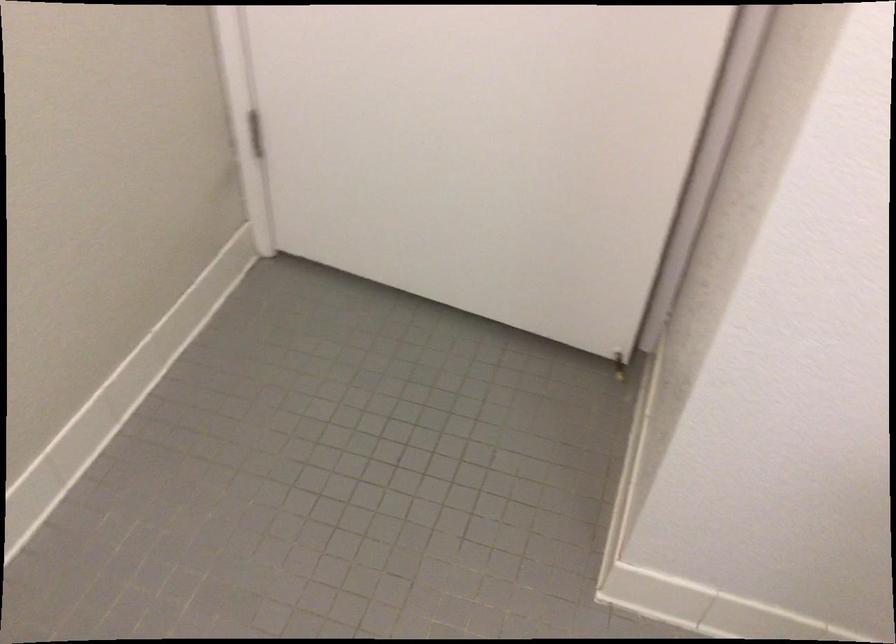
Which object does [618,366] point to?

This point indicates the brass door stop.